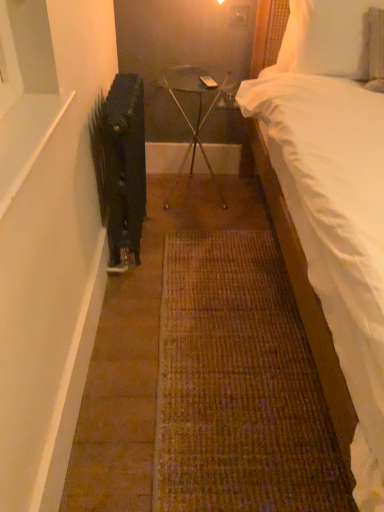
Question: Does white soft pillow at upper right turn towards black matte radiator at left?

Choices:
 (A) yes
 (B) no

Answer: (B)

Question: Does white soft pillow at upper right have a lesser width compared to black matte radiator at left?

Choices:
 (A) no
 (B) yes

Answer: (B)

Question: Would you consider white soft pillow at upper right to be distant from black matte radiator at left?

Choices:
 (A) no
 (B) yes

Answer: (A)

Question: Is black matte radiator at left a part of white soft pillow at upper right?

Choices:
 (A) no
 (B) yes

Answer: (A)

Question: From a real-world perspective, is white soft pillow at upper right physically above black matte radiator at left?

Choices:
 (A) no
 (B) yes

Answer: (B)

Question: Does white soft pillow at upper right appear on the right side of black matte radiator at left?

Choices:
 (A) no
 (B) yes

Answer: (B)

Question: Considering the relative sizes of black matte radiator at left and white soft pillow at upper right in the image provided, is black matte radiator at left smaller than white soft pillow at upper right?

Choices:
 (A) no
 (B) yes

Answer: (A)

Question: From a real-world perspective, does black matte radiator at left sit lower than white soft pillow at upper right?

Choices:
 (A) no
 (B) yes

Answer: (B)

Question: Is black matte radiator at left aimed at white soft pillow at upper right?

Choices:
 (A) no
 (B) yes

Answer: (B)

Question: Does black matte radiator at left have a greater height compared to white soft pillow at upper right?

Choices:
 (A) yes
 (B) no

Answer: (A)

Question: Does black matte radiator at left appear on the left side of white soft pillow at upper right?

Choices:
 (A) yes
 (B) no

Answer: (A)

Question: From the image's perspective, is black matte radiator at left below white soft pillow at upper right?

Choices:
 (A) no
 (B) yes

Answer: (B)

Question: Is metallic glass table at center at the left side of white soft pillow at upper right?

Choices:
 (A) yes
 (B) no

Answer: (A)